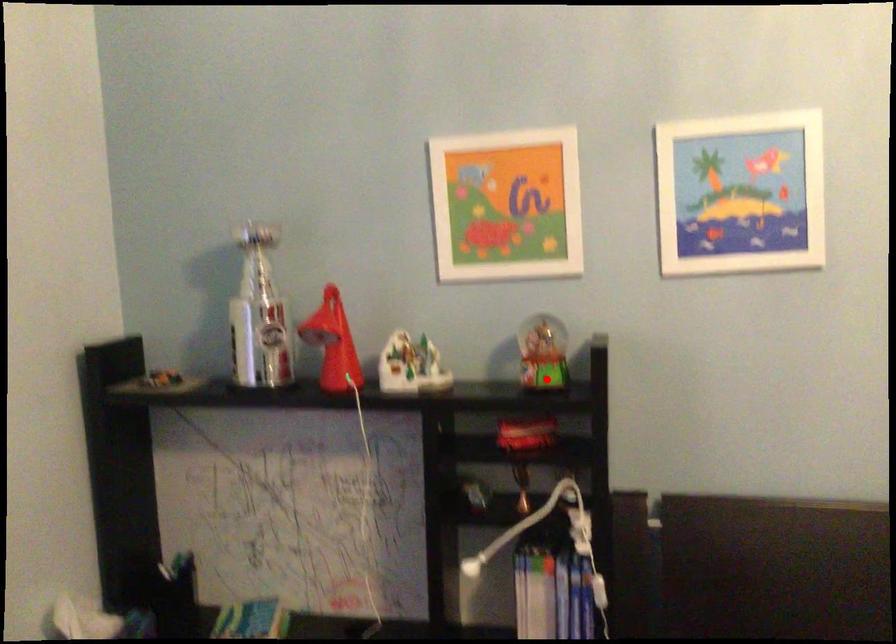
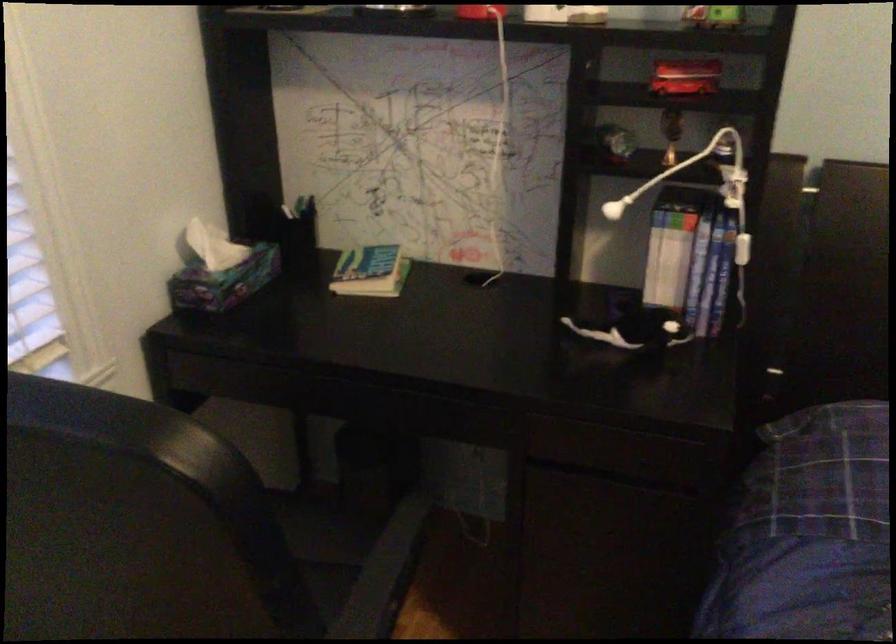
Question: I am providing you with two images of the same scene from different viewpoints. Given a red point in image1, look at the same physical point in image2. Is it:

Choices:
 (A) Closer to the viewpoint
 (B) Farther from the viewpoint

Answer: (A)